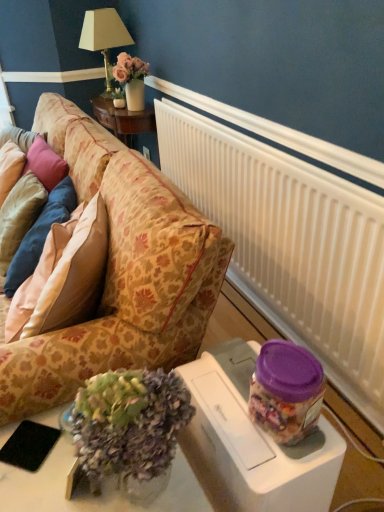
Question: From the image's perspective, is white plastic radiator at upper right on top of black matte pad at lower left?

Choices:
 (A) no
 (B) yes

Answer: (B)

Question: Can you confirm if white plastic radiator at upper right is wider than black matte pad at lower left?

Choices:
 (A) no
 (B) yes

Answer: (A)

Question: Would you say black matte pad at lower left is part of white plastic radiator at upper right's contents?

Choices:
 (A) yes
 (B) no

Answer: (B)

Question: Is white plastic radiator at upper right thinner than black matte pad at lower left?

Choices:
 (A) yes
 (B) no

Answer: (A)

Question: From a real-world perspective, is white plastic radiator at upper right under black matte pad at lower left?

Choices:
 (A) yes
 (B) no

Answer: (A)

Question: In terms of width, does white plastic radiator at upper right look wider or thinner when compared to translucent glass vase at lower left?

Choices:
 (A) wide
 (B) thin

Answer: (B)

Question: From the image's perspective, relative to translucent glass vase at lower left, is white plastic radiator at upper right above or below?

Choices:
 (A) above
 (B) below

Answer: (A)

Question: From a real-world perspective, is white plastic radiator at upper right positioned above or below translucent glass vase at lower left?

Choices:
 (A) below
 (B) above

Answer: (A)

Question: Choose the correct answer: Is white plastic radiator at upper right inside translucent glass vase at lower left or outside it?

Choices:
 (A) outside
 (B) inside

Answer: (A)

Question: Is translucent glass vase at lower left to the left or to the right of floral-patterned fabric couch at left in the image?

Choices:
 (A) left
 (B) right

Answer: (B)

Question: In terms of height, does translucent glass vase at lower left look taller or shorter compared to floral-patterned fabric couch at left?

Choices:
 (A) tall
 (B) short

Answer: (B)

Question: In terms of size, does translucent glass vase at lower left appear bigger or smaller than floral-patterned fabric couch at left?

Choices:
 (A) small
 (B) big

Answer: (A)

Question: Considering the positions of translucent glass vase at lower left and floral-patterned fabric couch at left in the image, is translucent glass vase at lower left wider or thinner than floral-patterned fabric couch at left?

Choices:
 (A) thin
 (B) wide

Answer: (A)

Question: Is point (51, 199) closer or farther from the camera than point (97, 26)?

Choices:
 (A) farther
 (B) closer

Answer: (B)

Question: From a real-world perspective, relative to gold metallic table lamp at upper left, is pink satin pillow at left, the second pillow from the left, vertically above or below?

Choices:
 (A) below
 (B) above

Answer: (A)